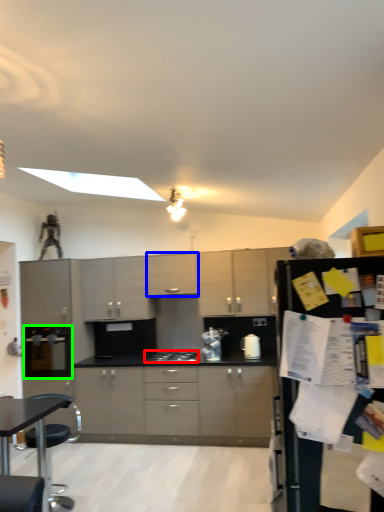
Question: Which object is positioned closest to gas stove (highlighted by a red box)? Select from cabinetry (highlighted by a blue box) and appliance (highlighted by a green box).

Choices:
 (A) cabinetry
 (B) appliance

Answer: (A)